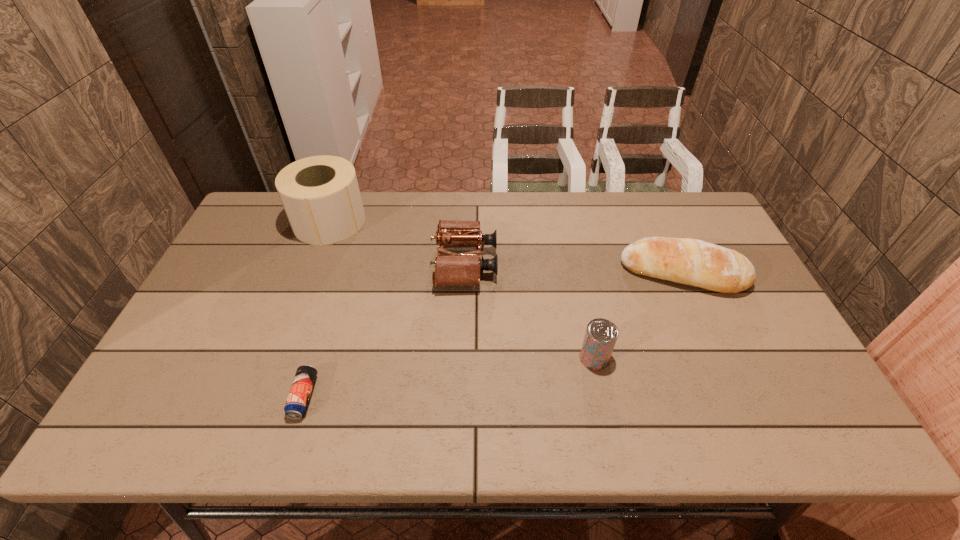
Find the location of a particular element. toilet tissue is located at coordinates (320, 194).

What are the coordinates of `the third object from right to left` in the screenshot? It's located at [x=452, y=269].

The height and width of the screenshot is (540, 960). Identify the location of bread. (694, 262).

Find the location of a particular element. The height and width of the screenshot is (540, 960). the right beer can is located at coordinates (601, 335).

This screenshot has height=540, width=960. What are the coordinates of `the taller beer can` in the screenshot? It's located at (601, 335).

Locate an element on the screen. The width and height of the screenshot is (960, 540). the shorter beer can is located at coordinates click(x=296, y=405).

At what (x,y) coordinates should I click in order to perform the action: click on the shortest object. Please return your answer as a coordinate pair (x, y). Looking at the image, I should click on (296, 405).

Identify the location of vacant space located on the left of the toilet tissue. (264, 222).

Identify the location of vacant point located through the eyepieces of the binoculars. (529, 264).

In order to click on free region located 0.150m on the front of the rightmost object in this screenshot , I will do coord(714,342).